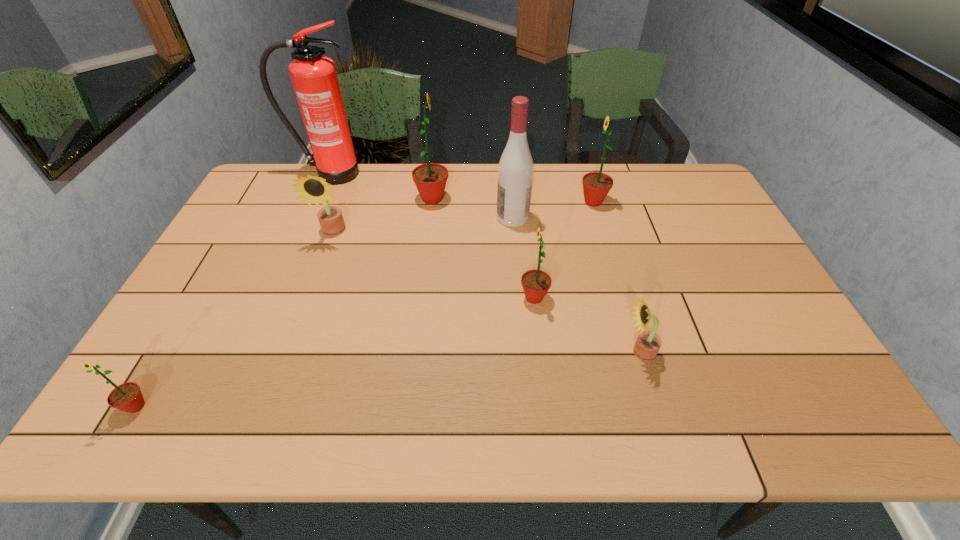
This screenshot has height=540, width=960. In order to click on red fire extinguisher in this screenshot , I will do `click(314, 77)`.

The image size is (960, 540). What are the coordinates of `fire extinguisher` in the screenshot? It's located at (314, 77).

Identify the location of alcohol. (515, 171).

Identify the location of the fourth object from left to right. (430, 179).

Find the location of a particular element. The height and width of the screenshot is (540, 960). the third green sunflower from right to left is located at coordinates (430, 179).

Locate an element on the screen. This screenshot has height=540, width=960. the third smallest green sunflower is located at coordinates (596, 185).

This screenshot has height=540, width=960. What are the coordinates of `the rightmost green sunflower` in the screenshot? It's located at (596, 185).

I want to click on the third biggest green sunflower, so click(536, 283).

You are a GUI agent. You are given a task and a screenshot of the screen. Output one action in this format:
    pyautogui.click(x=<x>, y=<y>)
    Task: Click on the fourth farthest sunflower
    Image resolution: width=960 pixels, height=540 pixels.
    Given the screenshot: What is the action you would take?
    pyautogui.click(x=536, y=283)

This screenshot has height=540, width=960. Find the location of `the third farthest sunflower`. the third farthest sunflower is located at coordinates (312, 188).